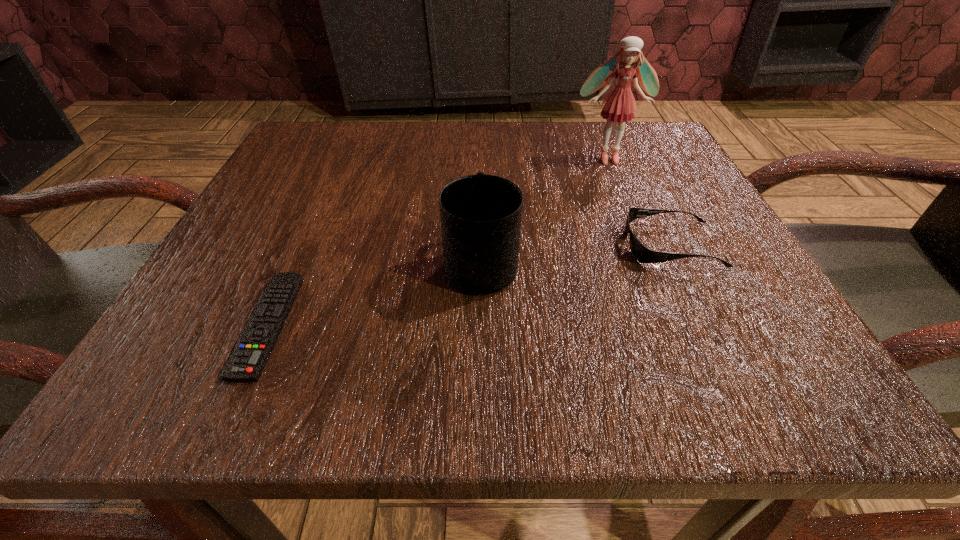
Find the location of a particular element. The image size is (960, 540). vacant area situated 0.120m on the side of the mug with the handle is located at coordinates (481, 190).

The image size is (960, 540). Identify the location of vacant point located 0.300m on the front-facing side of the second shortest object. (420, 245).

The image size is (960, 540). Identify the location of free location located 0.190m on the front-facing side of the second shortest object. (495, 245).

Locate an element on the screen. vacant position located on the front-facing side of the second shortest object is located at coordinates (351, 245).

Where is `vacant area situated 0.120m on the back of the leftmost object`? This screenshot has height=540, width=960. vacant area situated 0.120m on the back of the leftmost object is located at coordinates (313, 223).

Identify the location of object at the far edge. The image size is (960, 540). pyautogui.click(x=619, y=106).

The image size is (960, 540). In order to click on object present at the near edge in this screenshot , I will do `click(246, 363)`.

Where is `object that is at the left edge`? object that is at the left edge is located at coordinates (246, 363).

You are a GUI agent. You are given a task and a screenshot of the screen. Output one action in this format:
    pyautogui.click(x=<x>, y=<y>)
    Task: Click on the doll located in the right edge section of the desktop
    This screenshot has width=960, height=540.
    Given the screenshot: What is the action you would take?
    pyautogui.click(x=619, y=106)

The height and width of the screenshot is (540, 960). What are the coordinates of `sunglasses positioned at the right edge` in the screenshot? It's located at (642, 254).